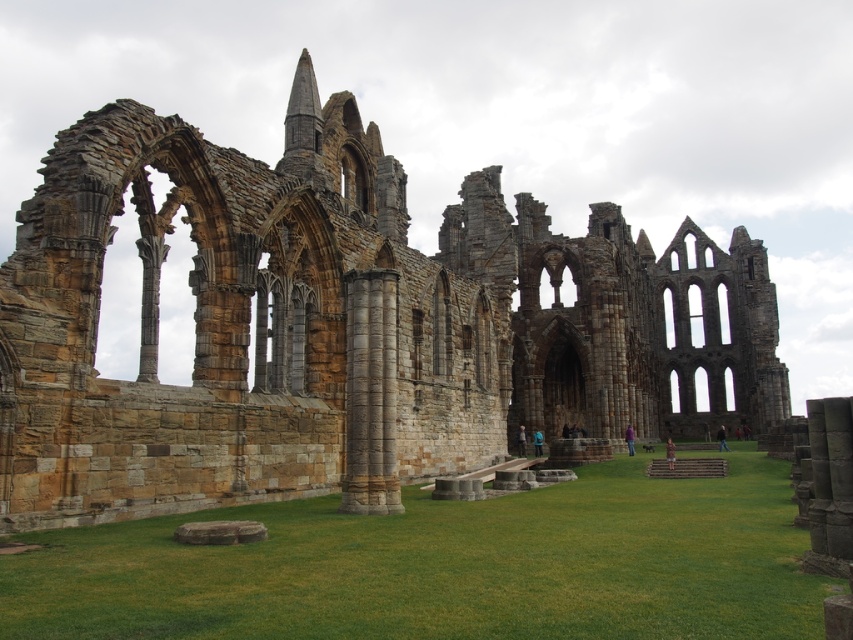
Does point (444, 467) lie behind point (403, 524)?

Yes, it is.

Measure the distance from brown stone ruins at center to green grass at center.

41.98 meters

Identify the location of brown stone ruins at center. (341, 324).

Where is `brown stone ruins at center`? The height and width of the screenshot is (640, 853). brown stone ruins at center is located at coordinates (341, 324).